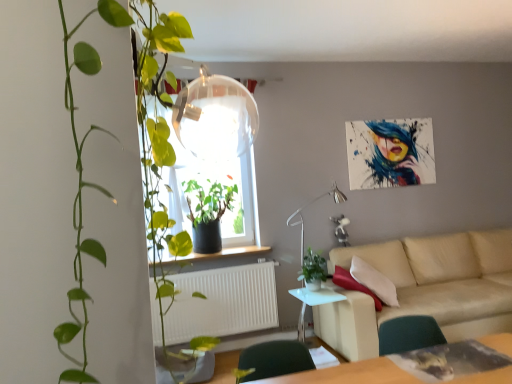
This screenshot has width=512, height=384. What do you see at coordinates (223, 302) in the screenshot? I see `white matte radiator at lower center` at bounding box center [223, 302].

What do you see at coordinates (313, 271) in the screenshot?
I see `green matte plant at center, acting as the second houseplant starting from the front` at bounding box center [313, 271].

Measure the distance between point (187, 183) and camera.

A distance of 12.53 feet exists between point (187, 183) and camera.

The width and height of the screenshot is (512, 384). Identify the location of white glossy side table at lower center. (313, 303).

Identify the location of white matte radiator at lower center. The height and width of the screenshot is (384, 512). (223, 302).

Is green glossy plant at left, which is the third houseplant from back to front, with white matte radiator at lower center?

They are not placed beside each other.

Considering the relative sizes of green glossy plant at left, which appears as the 1th houseplant when viewed from the front, and white matte radiator at lower center in the image provided, is green glossy plant at left, which appears as the 1th houseplant when viewed from the front, shorter than white matte radiator at lower center?

In fact, green glossy plant at left, which appears as the 1th houseplant when viewed from the front, may be taller than white matte radiator at lower center.

From the image's perspective, between green glossy plant at left, which is the third houseplant from back to front, and white matte radiator at lower center, which one is located above?

green glossy plant at left, which is the third houseplant from back to front, appears higher in the image.

Is point (210, 301) in front of point (354, 304)?

That is False.

Can you tell me how much white matte radiator at lower center and beige fabric couch at lower right differ in facing direction?

0.102 degrees.

Which of these two, white matte radiator at lower center or beige fabric couch at lower right, stands taller?

With more height is beige fabric couch at lower right.

From a real-world perspective, is white matte radiator at lower center positioned over beige fabric couch at lower right based on gravity?

Correct, in the physical world, white matte radiator at lower center is higher than beige fabric couch at lower right.

In the scene shown: Could you tell me if transparent glass window at center is turned towards green glossy plant at left, which is the third houseplant from back to front?

Yes, transparent glass window at center faces towards green glossy plant at left, which is the third houseplant from back to front.

Can green glossy plant at left, which is the third houseplant from back to front, be found inside transparent glass window at center?

No, green glossy plant at left, which is the third houseplant from back to front, is not surrounded by transparent glass window at center.

Considering the sizes of transparent glass window at center and green glossy plant at left, which appears as the 1th houseplant when viewed from the front, in the image, is transparent glass window at center bigger or smaller than green glossy plant at left, which appears as the 1th houseplant when viewed from the front,?

transparent glass window at center is smaller than green glossy plant at left, which appears as the 1th houseplant when viewed from the front.

Can you tell me how much white glossy side table at lower center and green glossy plant at left, which is the third houseplant from back to front, differ in facing direction?

89.5 degrees separate the facing orientations of white glossy side table at lower center and green glossy plant at left, which is the third houseplant from back to front.

Who is shorter, white glossy side table at lower center or green glossy plant at left, which appears as the 1th houseplant when viewed from the front?

white glossy side table at lower center is shorter.

Would you say white glossy side table at lower center is a long distance from green glossy plant at left, which is the third houseplant from back to front?

Absolutely, white glossy side table at lower center is distant from green glossy plant at left, which is the third houseplant from back to front.

Could you measure the distance between white matte radiator at lower center and white glossy side table at lower center?

white matte radiator at lower center and white glossy side table at lower center are 23.69 inches apart.

Is white matte radiator at lower center spatially inside white glossy side table at lower center, or outside of it?

white matte radiator at lower center is not enclosed by white glossy side table at lower center.

Who is taller, white matte radiator at lower center or white glossy side table at lower center?

With more height is white matte radiator at lower center.

Is green matte plant at center, acting as the second houseplant starting from the front, in front of or behind transparent glass window at center in the image?

In the image, green matte plant at center, acting as the second houseplant starting from the front, appears in front of transparent glass window at center.

Is green matte plant at center, which appears as the 2th houseplant when viewed from the back, oriented away from transparent glass window at center?

green matte plant at center, which appears as the 2th houseplant when viewed from the back, is not turned away from transparent glass window at center.

Can you confirm if green matte plant at center, which appears as the 2th houseplant when viewed from the back, is thinner than transparent glass window at center?

Incorrect, the width of green matte plant at center, which appears as the 2th houseplant when viewed from the back, is not less than that of transparent glass window at center.

How different are the orientations of green matte plant at window, the 3th houseplant positioned from the front, and metallic silver lamp at center in degrees?

The angular difference between green matte plant at window, the 3th houseplant positioned from the front, and metallic silver lamp at center is 0.989 degrees.

Which is further, (213, 232) or (303, 327)?

Positioned behind is point (303, 327).

From the image's perspective, is green matte plant at window, the first houseplant from the back, located above or below metallic silver lamp at center?

green matte plant at window, the first houseplant from the back, is above metallic silver lamp at center.

Find the location of `radiator behind the green glossy plant at left, which appears as the 1th houseplant when viewed from the front`. radiator behind the green glossy plant at left, which appears as the 1th houseplant when viewed from the front is located at coordinates (223, 302).

In order to click on studio couch on the right of white matte radiator at lower center in this screenshot , I will do `click(425, 289)`.

From the image, which object appears to be farther from green matte plant at center, which appears as the 2th houseplant when viewed from the back, beige fabric couch at lower right or white glossy side table at lower center?

beige fabric couch at lower right is further to green matte plant at center, which appears as the 2th houseplant when viewed from the back.

Based on their spatial positions, is white glossy side table at lower center or green matte plant at window, the 3th houseplant positioned from the front, further from green matte plant at center, which appears as the 2th houseplant when viewed from the back?

green matte plant at window, the 3th houseplant positioned from the front, is positioned further to the anchor green matte plant at center, which appears as the 2th houseplant when viewed from the back.

When comparing their distances from transparent glass window at center, does white matte radiator at lower center or green glossy plant at left, which appears as the 1th houseplant when viewed from the front, seem further?

Among the two, green glossy plant at left, which appears as the 1th houseplant when viewed from the front, is located further to transparent glass window at center.

Looking at the image, which one is located closer to smooth wooden window sill at center, green matte plant at window, the first houseplant from the back, or metallic silver lamp at center?

green matte plant at window, the first houseplant from the back.

Estimate the real-world distances between objects in this image. Which object is closer to white matte radiator at lower center, transparent glass window at center or white glossy side table at lower center?

white glossy side table at lower center is closer to white matte radiator at lower center.

When comparing their distances from green matte plant at window, the first houseplant from the back, does metallic silver lamp at center or green matte plant at center, acting as the second houseplant starting from the front, seem closer?

metallic silver lamp at center is positioned closer to the anchor green matte plant at window, the first houseplant from the back.

From the picture: From the image, which object appears to be nearer to white matte radiator at lower center, green glossy plant at left, which appears as the 1th houseplant when viewed from the front, or smooth wooden window sill at center?

Based on the image, smooth wooden window sill at center appears to be nearer to white matte radiator at lower center.

Looking at the image, which one is located closer to green glossy plant at left, which is the third houseplant from back to front, green matte plant at center, acting as the second houseplant starting from the front, or metallic silver lamp at center?

The object closer to green glossy plant at left, which is the third houseplant from back to front, is green matte plant at center, acting as the second houseplant starting from the front.

I want to click on window sill located between green matte plant at window, the 3th houseplant positioned from the front, and green matte plant at center, acting as the second houseplant starting from the front, in the left-right direction, so click(x=219, y=254).

Identify the location of studio couch between green glossy plant at left, which is the third houseplant from back to front, and transparent glass window at center in the front-back direction. Image resolution: width=512 pixels, height=384 pixels. (425, 289).

This screenshot has height=384, width=512. Identify the location of window sill between transparent glass window at center and green matte plant at center, acting as the second houseplant starting from the front. (219, 254).

Find the location of a particular element. The width and height of the screenshot is (512, 384). table situated between green matte plant at window, the 3th houseplant positioned from the front, and metallic silver lamp at center from left to right is located at coordinates (313, 303).